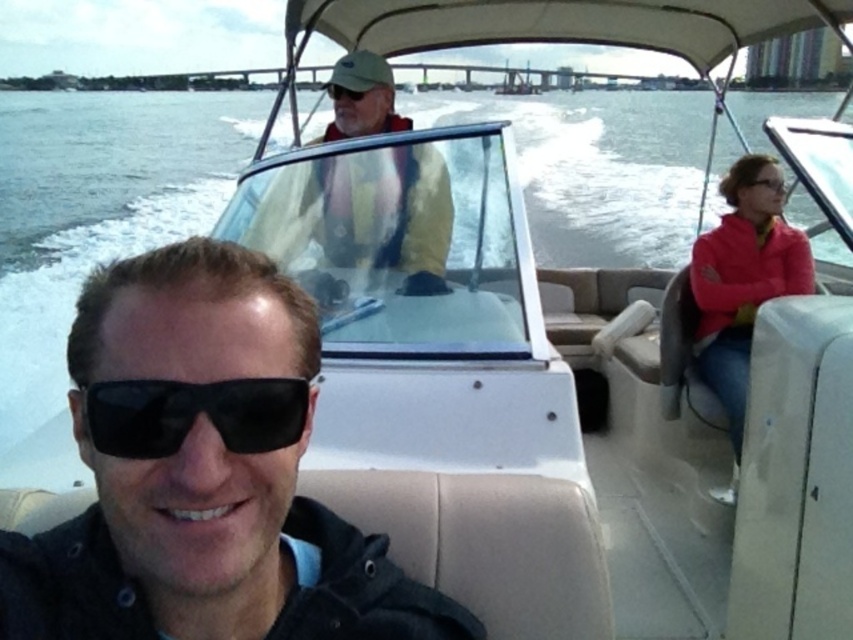
Is black matte sunglasses at center below yellow matte jacket at upper center?

Indeed, black matte sunglasses at center is positioned under yellow matte jacket at upper center.

Is black matte sunglasses at center to the left of yellow matte jacket at upper center from the viewer's perspective?

In fact, black matte sunglasses at center is to the right of yellow matte jacket at upper center.

Which is behind, point (413, 584) or point (381, 131)?

Positioned behind is point (381, 131).

Image resolution: width=853 pixels, height=640 pixels. I want to click on black matte sunglasses at center, so click(202, 474).

Is clear water at center thinner than matte black sunglasses at upper right?

Incorrect, clear water at center's width is not less than matte black sunglasses at upper right's.

What do you see at coordinates (112, 163) in the screenshot? I see `clear water at center` at bounding box center [112, 163].

Does point (90, 147) come closer to viewer compared to point (782, 189)?

No, it is not.

You are a GUI agent. You are given a task and a screenshot of the screen. Output one action in this format:
    pyautogui.click(x=<x>, y=<y>)
    Task: Click on the clear water at center
    Image resolution: width=853 pixels, height=640 pixels.
    Given the screenshot: What is the action you would take?
    point(112,163)

Does matte red jacket at right have a greater width compared to matte black sunglasses at upper right?

Yes.

Is matte red jacket at right shorter than matte black sunglasses at upper right?

In fact, matte red jacket at right may be taller than matte black sunglasses at upper right.

The height and width of the screenshot is (640, 853). What are the coordinates of `matte red jacket at right` in the screenshot? It's located at pyautogui.click(x=741, y=280).

The width and height of the screenshot is (853, 640). What are the coordinates of `matte red jacket at right` in the screenshot? It's located at (741, 280).